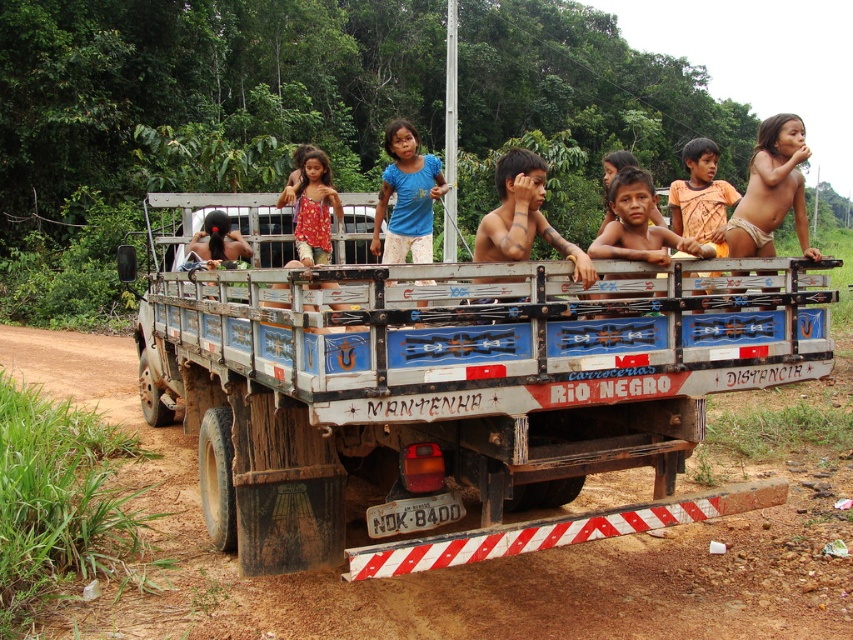
Question: Considering the real-world distances, which object is closest to the blue cotton shirt at center?

Choices:
 (A) red floral dress at center
 (B) wooden trailer truck at center
 (C) brown wooden truck at center

Answer: (A)

Question: Can you confirm if wooden trailer truck at center is positioned above brown wooden truck at center?

Choices:
 (A) yes
 (B) no

Answer: (B)

Question: Can you confirm if wooden trailer truck at center is smaller than blue cotton shirt at center?

Choices:
 (A) yes
 (B) no

Answer: (B)

Question: Which of the following is the closest to the observer?

Choices:
 (A) blue cotton shirt at center
 (B) wooden trailer truck at center

Answer: (B)

Question: Which point appears closest to the camera in this image?

Choices:
 (A) (541, 308)
 (B) (312, 188)
 (C) (490, 256)
 (D) (415, 186)

Answer: (A)

Question: Can you confirm if brown wooden truck at center is smaller than red floral dress at center?

Choices:
 (A) yes
 (B) no

Answer: (B)